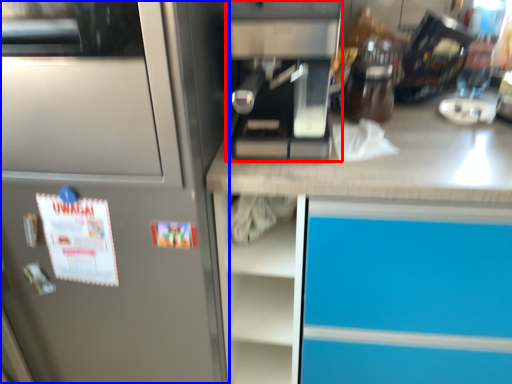
Question: Which object is further to the camera taking this photo, kitchen appliance (highlighted by a red box) or home appliance (highlighted by a blue box)?

Choices:
 (A) kitchen appliance
 (B) home appliance

Answer: (A)